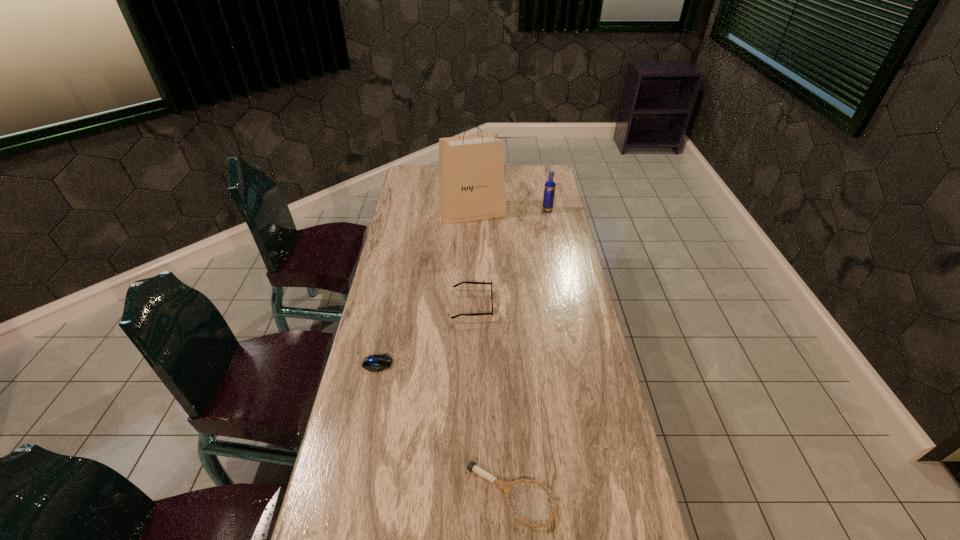
Where is `free space between the computer mouse and the second tallest object`? free space between the computer mouse and the second tallest object is located at coordinates (463, 287).

Find the location of a particular element. Image resolution: width=960 pixels, height=540 pixels. blank region between the third farthest object and the second tallest object is located at coordinates (510, 258).

The width and height of the screenshot is (960, 540). Find the location of `free area in between the tallest object and the rightmost object`. free area in between the tallest object and the rightmost object is located at coordinates (510, 212).

Find the location of a particular element. This screenshot has width=960, height=540. vacant space that's between the sunglasses and the vodka is located at coordinates (510, 258).

You are a GUI agent. You are given a task and a screenshot of the screen. Output one action in this format:
    pyautogui.click(x=<x>, y=<y>)
    Task: Click on the vacant space that's between the rightmost object and the shopping bag
    The image size is (960, 540).
    Given the screenshot: What is the action you would take?
    pyautogui.click(x=510, y=212)

Where is `free space between the vodka and the third farthest object`? The width and height of the screenshot is (960, 540). free space between the vodka and the third farthest object is located at coordinates (510, 258).

Where is `vacant region between the nearest object and the tallest object`? The width and height of the screenshot is (960, 540). vacant region between the nearest object and the tallest object is located at coordinates (492, 354).

This screenshot has height=540, width=960. Find the location of `unoccupied position between the nearest object and the tallest object`. unoccupied position between the nearest object and the tallest object is located at coordinates (492, 354).

The image size is (960, 540). I want to click on empty space between the leftmost object and the tennis racket, so click(x=444, y=429).

Choose which object is the third nearest neighbor to the vodka. Please provide its 2D coordinates. Your answer should be formatted as a tuple, i.e. [(x, y)], where the tuple contains the x and y coordinates of a point satisfying the conditions above.

[(374, 363)]